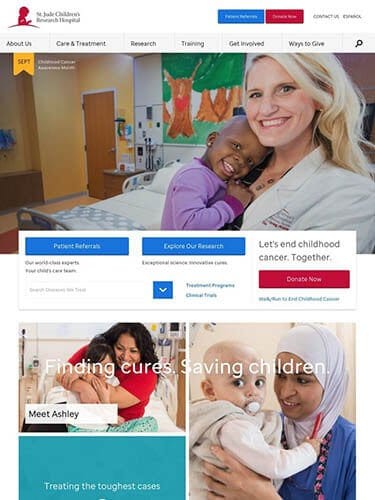
This screenshot has height=500, width=375. What are the coordinates of `patient's room` in the screenshot? It's located at (55, 139).